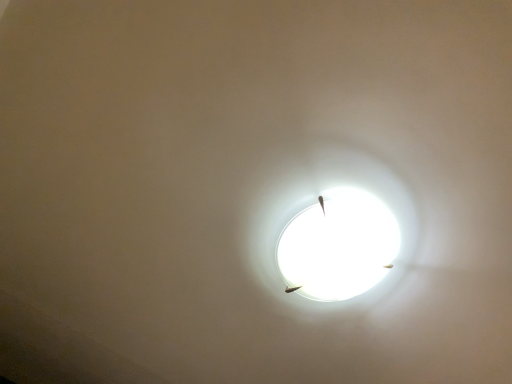
Where is `white glossy lamp at center`? Image resolution: width=512 pixels, height=384 pixels. white glossy lamp at center is located at coordinates (338, 246).

This screenshot has width=512, height=384. What do you see at coordinates (338, 246) in the screenshot? I see `white glossy lamp at center` at bounding box center [338, 246].

What are the coordinates of `white glossy lamp at center` in the screenshot? It's located at (338, 246).